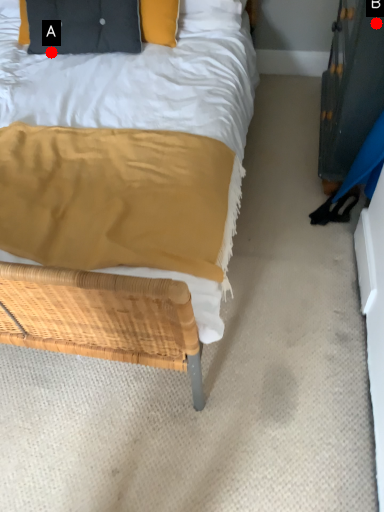
Question: Two points are circled on the image, labeled by A and B beside each circle. Which point is closer to the camera?

Choices:
 (A) A is closer
 (B) B is closer

Answer: (B)